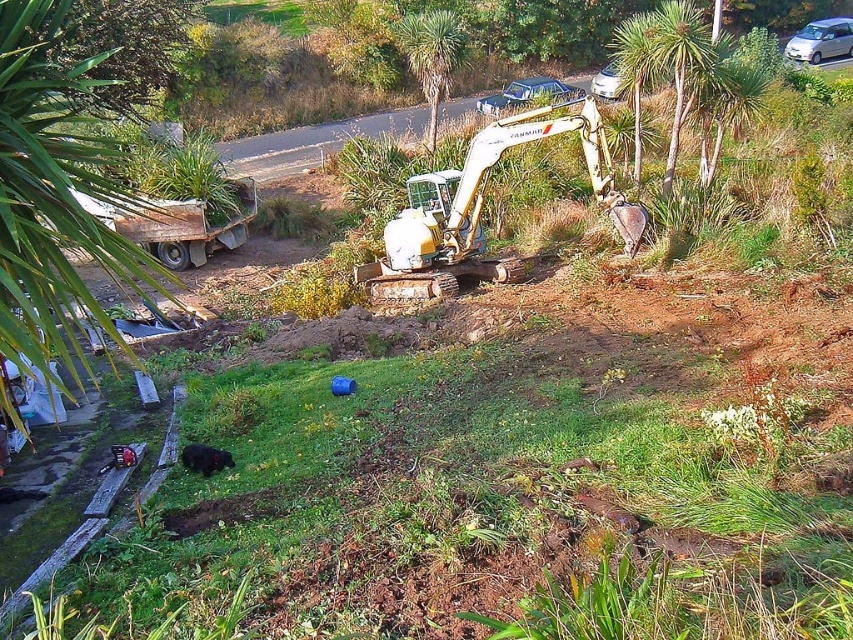
Between green leafy palm tree at upper center and metallic silver car at upper center, which one has less height?

Standing shorter between the two is metallic silver car at upper center.

Which of these two, green leafy palm tree at upper center or metallic silver car at upper center, stands taller?

With more height is green leafy palm tree at upper center.

Does point (636, 81) come farther from viewer compared to point (537, 92)?

That is False.

Find the location of a particular element. Image resolution: width=853 pixels, height=640 pixels. green leafy palm tree at upper center is located at coordinates 636,68.

Is silver metallic car at upper right to the right of metallic silver car at upper center from the viewer's perspective?

Yes, silver metallic car at upper right is to the right of metallic silver car at upper center.

Measure the distance from silver metallic car at upper right to metallic silver car at upper center.

The distance of silver metallic car at upper right from metallic silver car at upper center is 11.15 meters.

Does point (830, 52) come behind point (560, 96)?

That is True.

The height and width of the screenshot is (640, 853). In order to click on silver metallic car at upper right in this screenshot , I will do `click(820, 40)`.

Is green leafy palm tree at center smaller than silver metallic car at upper center?

Yes, green leafy palm tree at center is smaller than silver metallic car at upper center.

Who is more distant from viewer, [451,19] or [611,97]?

Point [611,97]

Find the location of a particular element. Image resolution: width=853 pixels, height=640 pixels. green leafy palm tree at center is located at coordinates (432, 56).